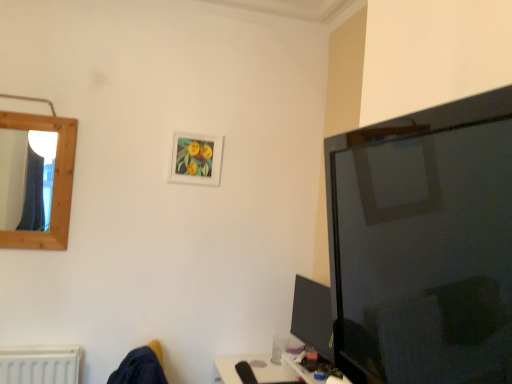
At what (x,y) coordinates should I click in order to perform the action: click on matte black monitor at lower right. Please return your answer as a coordinate pair (x, y). The width and height of the screenshot is (512, 384). Looking at the image, I should click on (313, 316).

Image resolution: width=512 pixels, height=384 pixels. What do you see at coordinates (313, 316) in the screenshot? I see `matte black monitor at lower right` at bounding box center [313, 316].

Describe the element at coordinates (196, 159) in the screenshot. This screenshot has width=512, height=384. I see `white matte picture frame at center` at that location.

In order to click on white matte picture frame at center in this screenshot , I will do `click(196, 159)`.

Identify the location of matte black monitor at lower right. (313, 316).

In the image, is matte black monitor at lower right on the left side or the right side of white matte picture frame at center?

Clearly, matte black monitor at lower right is on the right of white matte picture frame at center in the image.

Is matte black monitor at lower right positioned before white matte picture frame at center?

Yes, the depth of matte black monitor at lower right is less than that of white matte picture frame at center.

Which point is more distant from viewer, [311,300] or [200,166]?

The point [200,166] is farther from the camera.

From the image's perspective, which one is positioned higher, matte black monitor at lower right or white matte picture frame at center?

white matte picture frame at center appears higher in the image.

From a real-world perspective, between matte black monitor at lower right and white matte picture frame at center, who is vertically lower?

matte black monitor at lower right.

Does matte black monitor at lower right have a greater width compared to white matte picture frame at center?

Yes.

Is matte black monitor at lower right taller or shorter than white matte picture frame at center?

In the image, matte black monitor at lower right appears to be taller than white matte picture frame at center.

Considering the sizes of objects matte black monitor at lower right and white matte picture frame at center in the image provided, who is smaller, matte black monitor at lower right or white matte picture frame at center?

white matte picture frame at center is smaller.

From the picture: Is white matte picture frame at center located within matte black monitor at lower right?

No, white matte picture frame at center is not inside matte black monitor at lower right.

Are matte black monitor at lower right and white matte picture frame at center located far from each other?

Actually, matte black monitor at lower right and white matte picture frame at center are a little close together.

Is matte black monitor at lower right aimed at white matte picture frame at center?

No, matte black monitor at lower right is not turned towards white matte picture frame at center.

Can you tell me how much matte black monitor at lower right and white matte picture frame at center differ in facing direction?

There is a 85.3-degree angle between the facing directions of matte black monitor at lower right and white matte picture frame at center.

How distant is matte black monitor at lower right from white matte picture frame at center?

A distance of 35.06 inches exists between matte black monitor at lower right and white matte picture frame at center.

Where is `picture frame that is above the matte black monitor at lower right (from the image's perspective)`? The height and width of the screenshot is (384, 512). picture frame that is above the matte black monitor at lower right (from the image's perspective) is located at coordinates (196, 159).

Which is more to the left, white matte picture frame at center or matte black monitor at lower right?

Positioned to the left is white matte picture frame at center.

Considering the positions of objects white matte picture frame at center and matte black monitor at lower right in the image provided, who is in front, white matte picture frame at center or matte black monitor at lower right?

matte black monitor at lower right is closer to the camera.

Is point (206, 156) closer or farther from the camera than point (293, 311)?

Point (206, 156) is positioned closer to the camera compared to point (293, 311).

From the image's perspective, is white matte picture frame at center over matte black monitor at lower right?

Yes, from the image's perspective, white matte picture frame at center is above matte black monitor at lower right.

From a real-world perspective, between white matte picture frame at center and matte black monitor at lower right, who is vertically higher?

From a 3D spatial view, white matte picture frame at center is above.

In terms of width, does white matte picture frame at center look wider or thinner when compared to matte black monitor at lower right?

Clearly, white matte picture frame at center has less width compared to matte black monitor at lower right.

In the scene shown: Between white matte picture frame at center and matte black monitor at lower right, which one has less height?

Standing shorter between the two is white matte picture frame at center.

Is white matte picture frame at center smaller than matte black monitor at lower right?

Yes, white matte picture frame at center is smaller than matte black monitor at lower right.

Can we say white matte picture frame at center lies outside matte black monitor at lower right?

Yes, white matte picture frame at center is outside of matte black monitor at lower right.

Is white matte picture frame at center next to matte black monitor at lower right?

white matte picture frame at center is not next to matte black monitor at lower right, and they're not touching.

Is white matte picture frame at center looking in the opposite direction of matte black monitor at lower right?

No, white matte picture frame at center is not facing the opposite direction of matte black monitor at lower right.

Can you tell me how much white matte picture frame at center and matte black monitor at lower right differ in facing direction?

white matte picture frame at center and matte black monitor at lower right are facing 85.3 degrees away from each other.

Where is `picture frame that is above the matte black monitor at lower right (from the image's perspective)`? The width and height of the screenshot is (512, 384). picture frame that is above the matte black monitor at lower right (from the image's perspective) is located at coordinates (196, 159).

Find the location of a particular element. The width and height of the screenshot is (512, 384). tv show below the white matte picture frame at center (from the image's perspective) is located at coordinates (313, 316).

Image resolution: width=512 pixels, height=384 pixels. Identify the location of tv show on the right of white matte picture frame at center. (313, 316).